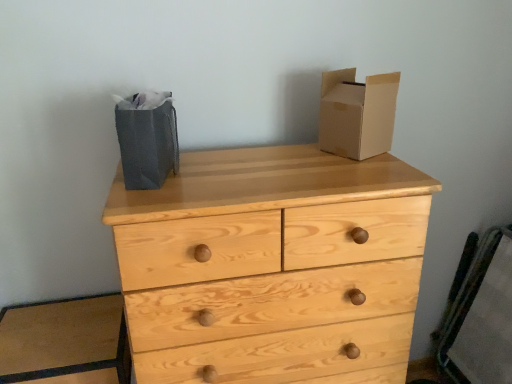
Identify the location of free space on the front side of cardboard box at upper right. The width and height of the screenshot is (512, 384). click(373, 163).